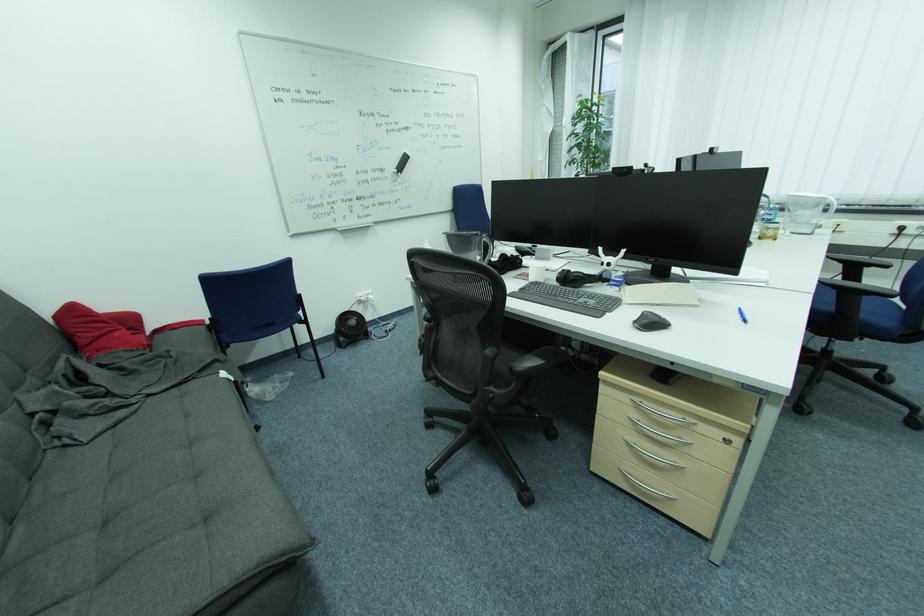
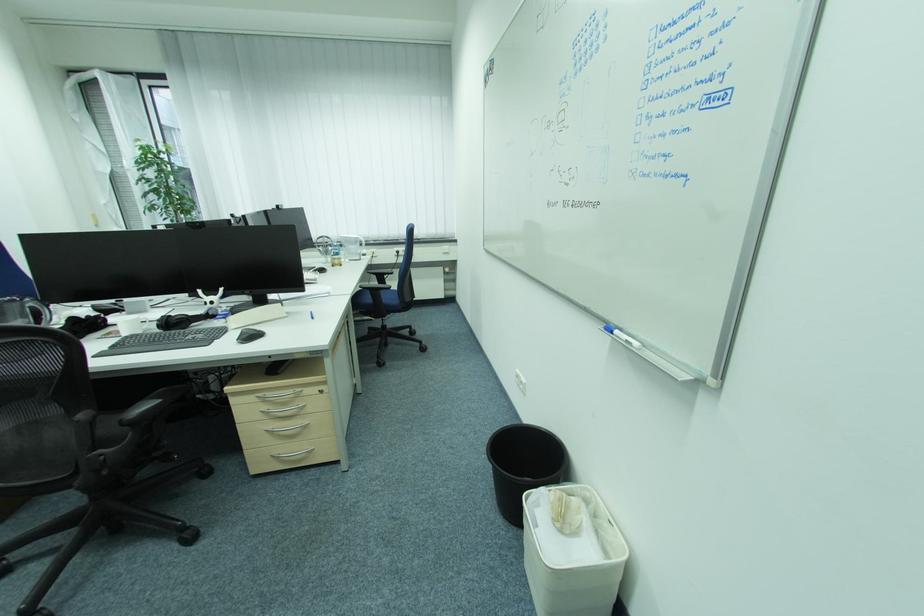
In the second image, find the point that corresponds to (x=687, y=418) in the first image.

(299, 392)